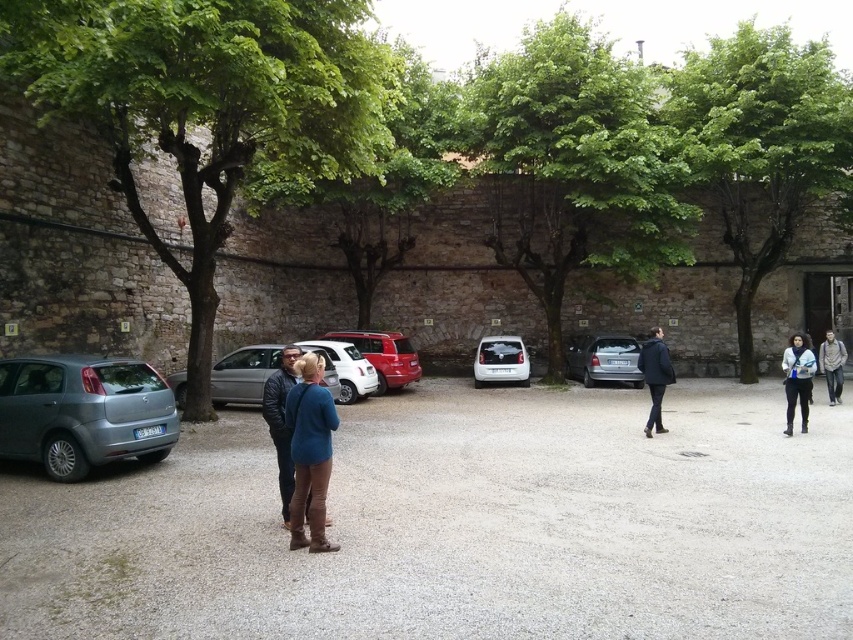
Question: Estimate the real-world distances between objects in this image. Which object is farther from the metallic gray car at lower left?

Choices:
 (A) green leafy tree at upper right
 (B) blue suede boots at center

Answer: (A)

Question: Does green leafy tree at left appear under silver metallic van at center-left?

Choices:
 (A) yes
 (B) no

Answer: (B)

Question: Does blue suede boots at center come in front of white matte car at center?

Choices:
 (A) yes
 (B) no

Answer: (A)

Question: Can you confirm if blue denim jacket at right is wider than dark blue jacket at right?

Choices:
 (A) no
 (B) yes

Answer: (B)

Question: Which of the following is the closest to the observer?

Choices:
 (A) white matte hatchback at center
 (B) blue denim jacket at right

Answer: (B)

Question: Which of these objects is positioned closest to the leather jacket at center?

Choices:
 (A) shiny red car at center
 (B) dark blue jacket at right
 (C) blue suede boots at center
 (D) metallic gray car at lower left

Answer: (C)